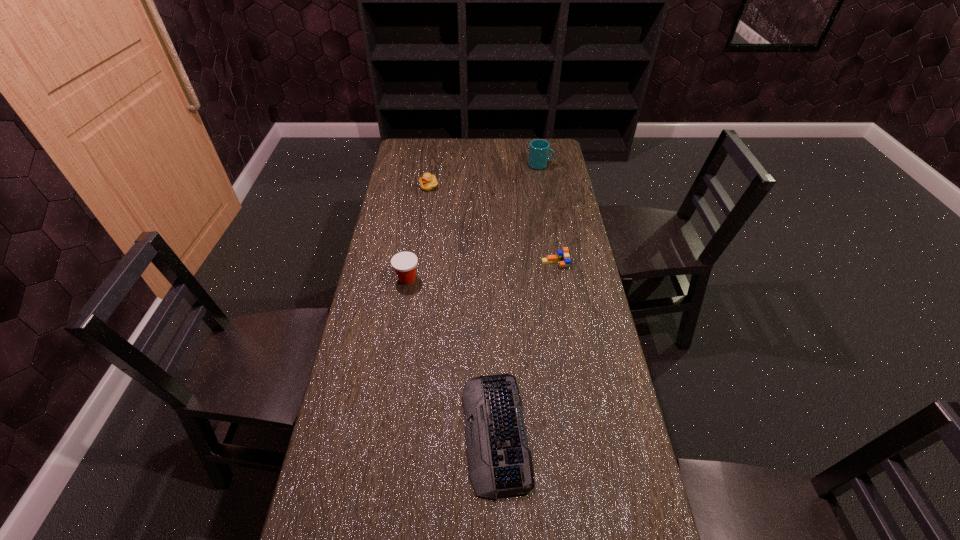
In order to click on vacant area that lies between the farthest object and the fourth nearest object in this screenshot , I will do `click(485, 176)`.

Locate an element on the screen. This screenshot has height=540, width=960. vacant area between the cup and the computer keyboard is located at coordinates (518, 299).

Identify the location of blank region between the Lego and the fourth farthest object. (481, 272).

Identify the location of the fourth closest object relative to the third tallest object. The width and height of the screenshot is (960, 540). (500, 463).

Identify the location of object that can be found as the third closest to the fourth nearest object. (562, 257).

At what (x,y) coordinates should I click in order to perform the action: click on vacant space that satisfies the following two spatial constraints: 1. on the handle side of the farthest object; 2. on the front-facing side of the second farthest object. Please return your answer as a coordinate pair (x, y). This screenshot has width=960, height=540. Looking at the image, I should click on [544, 186].

The height and width of the screenshot is (540, 960). I want to click on vacant region that satisfies the following two spatial constraints: 1. on the handle side of the farthest object; 2. on the front-facing side of the fourth nearest object, so pos(544,186).

I want to click on vacant space that satisfies the following two spatial constraints: 1. on the front-facing side of the Lego; 2. on the right side of the third tallest object, so click(x=418, y=264).